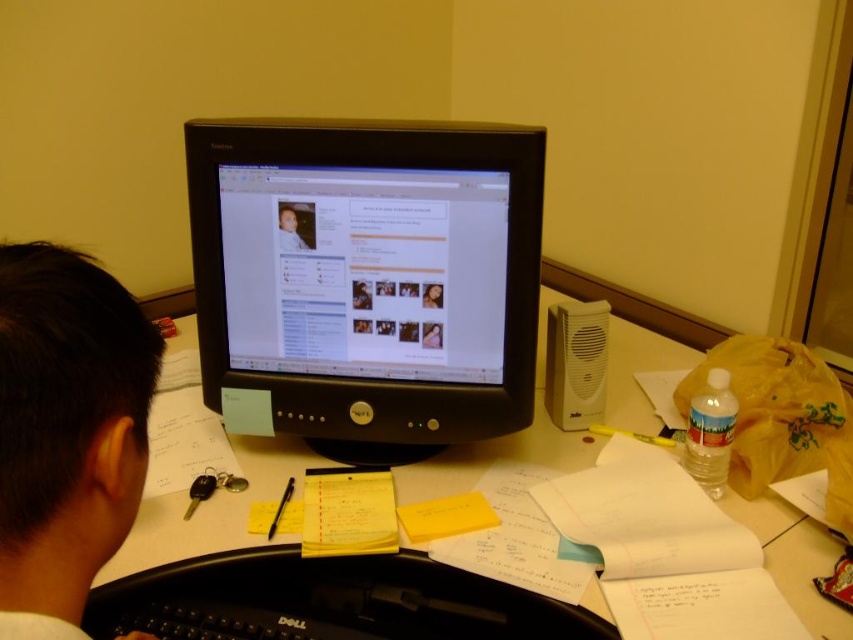
Question: Which point appears closest to the camera in this image?

Choices:
 (A) (474, 499)
 (B) (105, 544)

Answer: (B)

Question: Can you confirm if black plastic monitor at center is positioned to the left of white paper at center?

Choices:
 (A) yes
 (B) no

Answer: (A)

Question: Observing the image, what is the correct spatial positioning of black plastic monitor at center in reference to black hair at upper left?

Choices:
 (A) left
 (B) right

Answer: (B)

Question: Estimate the real-world distances between objects in this image. Which object is farther from the yellow matte sticky notes at center?

Choices:
 (A) black plastic monitor at center
 (B) white paper at center

Answer: (A)

Question: Does black plastic monitor at center have a smaller size compared to yellow matte sticky notes at center?

Choices:
 (A) yes
 (B) no

Answer: (B)

Question: Which point is closer to the camera?

Choices:
 (A) black plastic monitor at center
 (B) white paper at center
 (C) yellow matte sticky notes at center
 (D) black hair at upper left

Answer: (D)